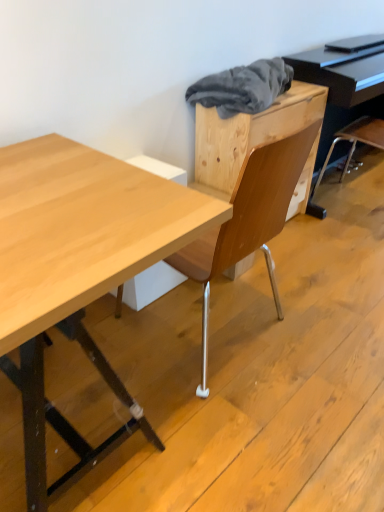
Question: Is point (254, 108) positioned closer to the camera than point (26, 158)?

Choices:
 (A) farther
 (B) closer

Answer: (A)

Question: Would you say gray fabric at upper center is inside or outside natural wood desk at center?

Choices:
 (A) inside
 (B) outside

Answer: (B)

Question: Which is farther from the natural wood desk at center?

Choices:
 (A) black glossy piano at upper right
 (B) gray fabric at upper center

Answer: (A)

Question: Which of these objects is positioned farthest from the gray fabric at upper center?

Choices:
 (A) black glossy piano at upper right
 (B) natural wood desk at center

Answer: (B)